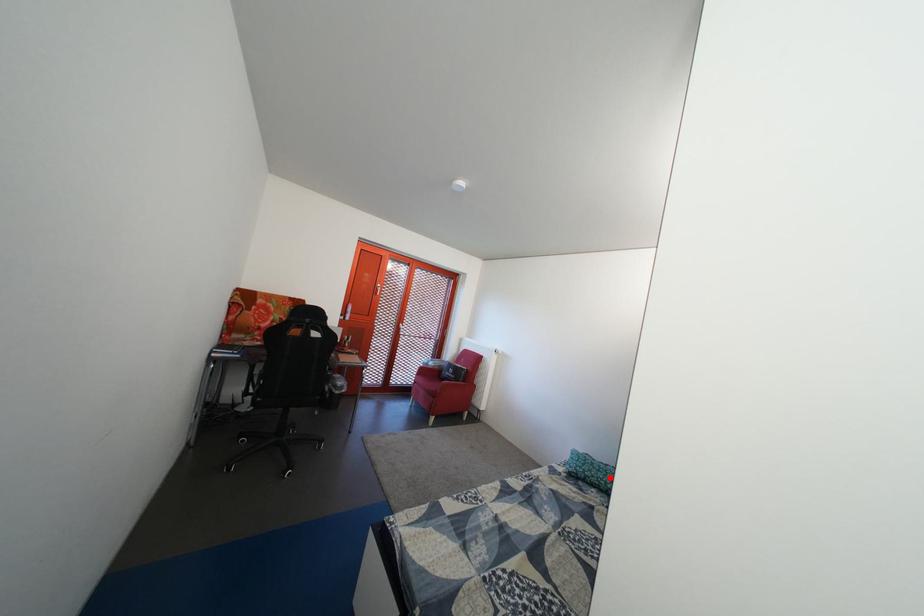
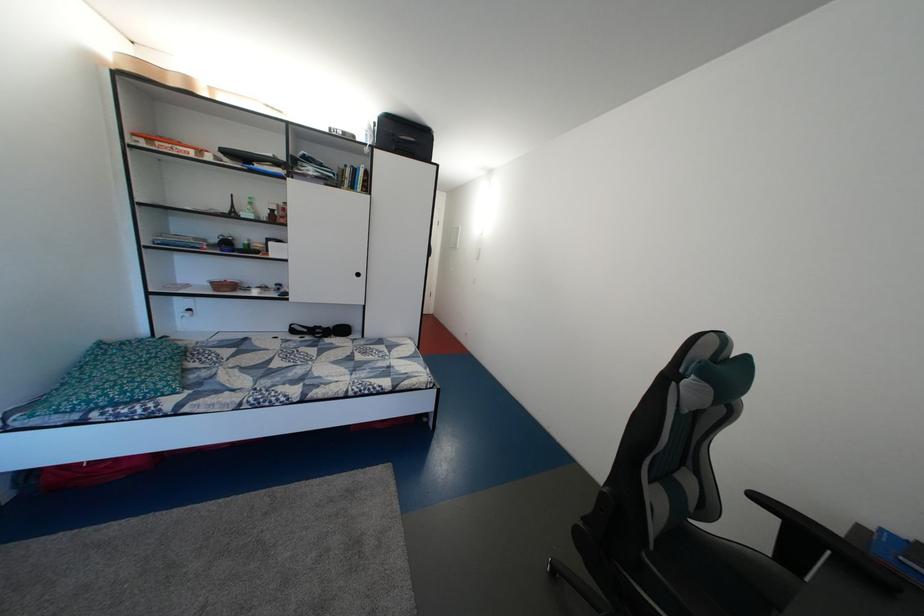
Question: I am providing you with two images of the same scene from different viewpoints. In image1, a red point is highlighted. Considering the same 3D point in image2, which of the following is correct?

Choices:
 (A) It is closer
 (B) It is farther

Answer: (B)